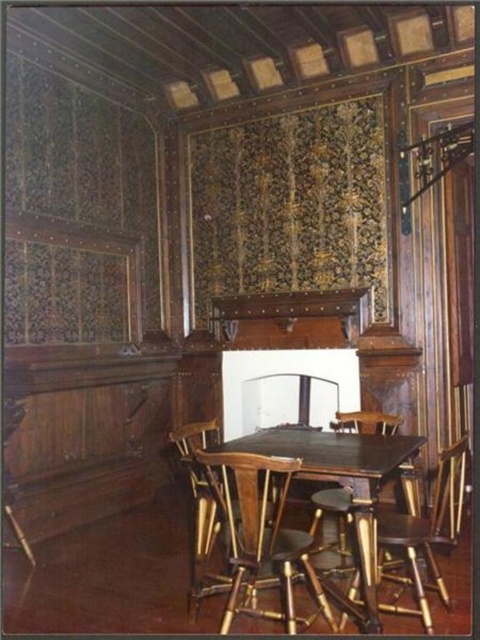
Does wooden bar stool at center appear over wooden chair at center?

Yes, wooden bar stool at center is above wooden chair at center.

Can you confirm if wooden bar stool at center is bigger than wooden chair at center?

Correct, wooden bar stool at center is larger in size than wooden chair at center.

Who is more forward, (x=360, y=506) or (x=364, y=428)?

Point (x=360, y=506) is more forward.

Where is `wooden bar stool at center`? wooden bar stool at center is located at coordinates (350, 552).

Does wooden table at center appear on the right side of wooden chair at center?

In fact, wooden table at center is to the left of wooden chair at center.

Which is behind, point (266, 436) or point (380, 426)?

Point (380, 426)

At what (x,y) coordinates should I click in order to perform the action: click on wooden table at center. Please return your answer as a coordinate pair (x, y). This screenshot has width=480, height=640. Looking at the image, I should click on (331, 454).

Does point (367, 572) come in front of point (375, 540)?

Yes, point (367, 572) is closer to viewer.

Consider the image. Is wooden table at center further to the viewer compared to wooden bar stool at center?

No, wooden table at center is closer to the viewer.

Is point (332, 461) closer to camera compared to point (359, 540)?

No, (332, 461) is further to viewer.

Where is `wooden table at center`? The height and width of the screenshot is (640, 480). wooden table at center is located at coordinates (331, 454).